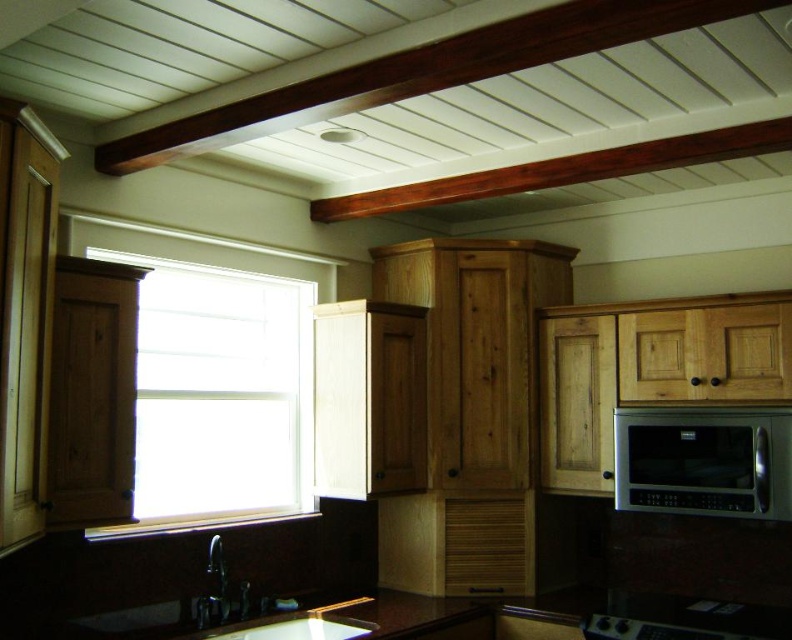
You are a delivery person trying to place a new microwave that is 1.5 feet wide into the kitchen. The current microwave, the satin silver microwave at upper right, needs to be moved to make space. Can you fit the new microwave next to the white matte window at center without moving any other appliances?

The distance between the white matte window at center and the satin silver microwave at upper right is 5.26 feet. Since the new microwave is only 1.5 feet wide, there is sufficient space to place it next to the white matte window at center without moving other appliances.

You are standing in the kitchen and want to open the white matte window at center to let in some fresh air. However, the satin silver microwave at upper right is blocking your path. Can you reach the window without moving the microwave?

The white matte window at center is closer to the viewer than the satin silver microwave at upper right, so you can reach the window without moving the microwave because it is in front of the microwave.

You are a kitchen designer planning to install a new appliance. You have a satin silver microwave at upper right and a white matte window at center. Which object has a bigger size?

The white matte window at center has a larger size compared to the satin silver microwave at upper right.